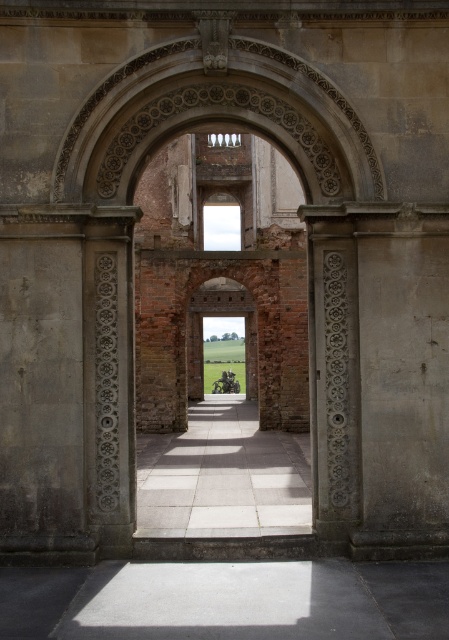
Is smooth stone pillar at center to the right of white stone path at center from the viewer's perspective?

Yes, smooth stone pillar at center is to the right of white stone path at center.

Does smooth stone pillar at center have a larger size compared to white stone path at center?

No, smooth stone pillar at center is not bigger than white stone path at center.

This screenshot has width=449, height=640. I want to click on smooth stone pillar at center, so click(x=378, y=376).

You are a GUI agent. You are given a task and a screenshot of the screen. Output one action in this format:
    pyautogui.click(x=<x>, y=<y>)
    Task: Click on the smooth stone pillar at center
    The height and width of the screenshot is (640, 449).
    Given the screenshot: What is the action you would take?
    (378, 376)